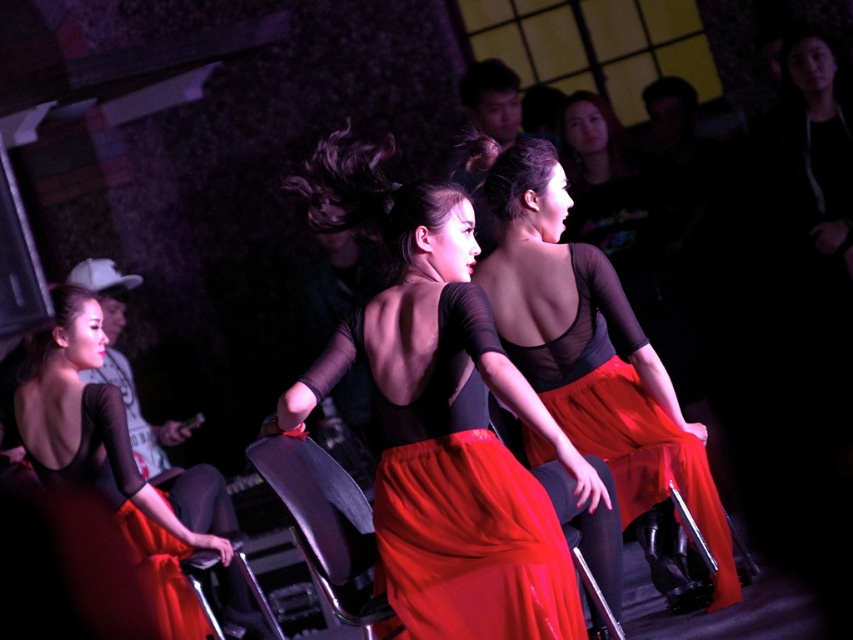
Based on the photo, you are a stagehand who needs to place a microphone stand at the exact center of the stage. However, you must avoid placing it where the matte black dress at center is currently positioned. Based on the coordinates provided, where should you place the microphone stand instead?

The microphone stand should be placed at the exact center of the stage, which is different from the position of the matte black dress at center located at point (128, 506). Since the exact center is not specified, the stagehand should position it at the geometric center of the stage area, avoiding the coordinates given for the matte black dress at center.

You are a photographer trying to capture the dancer wearing a matte black leotard at center. You want to place your focus point at the exact center of their leotard. Based on the coordinates provided, is the point at (447,432) the correct location to focus on?

Yes, the point at (447,432) is on the matte black leotard at center, so placing the focus point there will correctly target the center of their leotard.